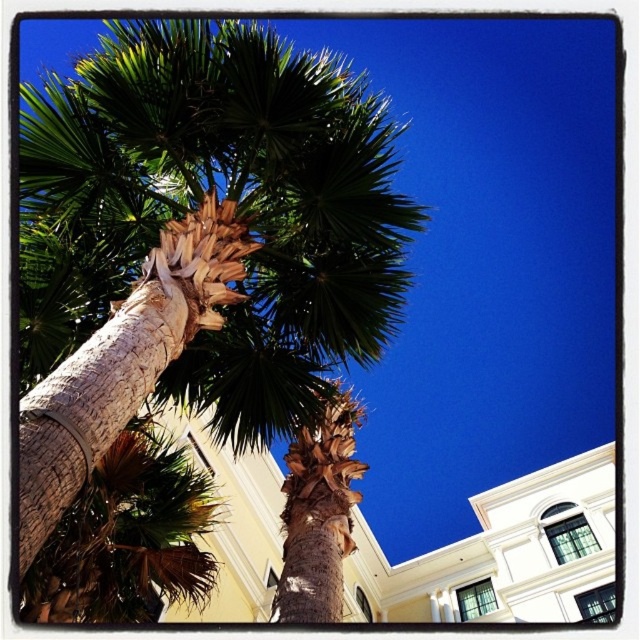
Does green leafy palm tree at center have a larger size compared to brown textured bark at center?

Yes, green leafy palm tree at center is bigger than brown textured bark at center.

Which is behind, point (125, 112) or point (314, 561)?

Positioned behind is point (125, 112).

Image resolution: width=640 pixels, height=640 pixels. What are the coordinates of `green leafy palm tree at center` in the screenshot? It's located at (193, 259).